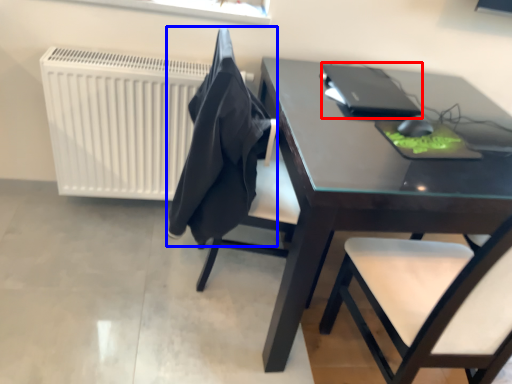
Question: Which object is further to the camera taking this photo, laptop (highlighted by a red box) or cloth (highlighted by a blue box)?

Choices:
 (A) laptop
 (B) cloth

Answer: (A)